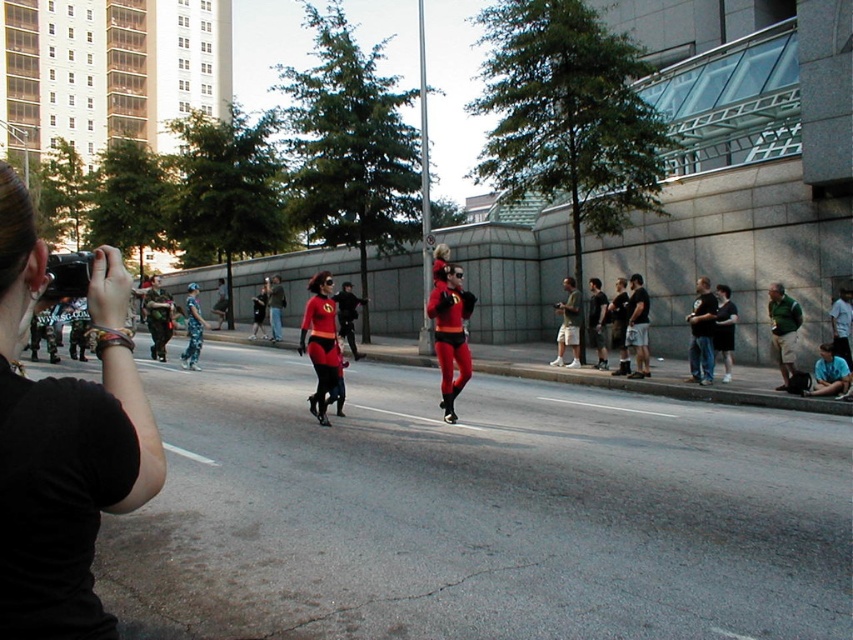
Question: Considering the real-world distances, which object is closest to the dark gray shorts at right?

Choices:
 (A) green jersey at right
 (B) camouflage pants at center
 (C) matte red costume at center

Answer: (A)

Question: Does black fabric camera at left appear on the right side of matte red costume at center?

Choices:
 (A) no
 (B) yes

Answer: (B)

Question: Can you confirm if green jersey at right is wider than dark gray shorts at right?

Choices:
 (A) yes
 (B) no

Answer: (B)

Question: Which point appears closest to the camera in this image?

Choices:
 (A) (305, 305)
 (B) (560, 326)
 (C) (16, 289)

Answer: (C)

Question: Is shiny red spandex suit at center smaller than matte black shirt at center?

Choices:
 (A) yes
 (B) no

Answer: (A)

Question: Estimate the real-world distances between objects in this image. Which object is closer to the matte red costume at center?

Choices:
 (A) dark gray shorts at right
 (B) camouflage pants at center
 (C) green jersey at right
 (D) matte black shorts at right

Answer: (B)